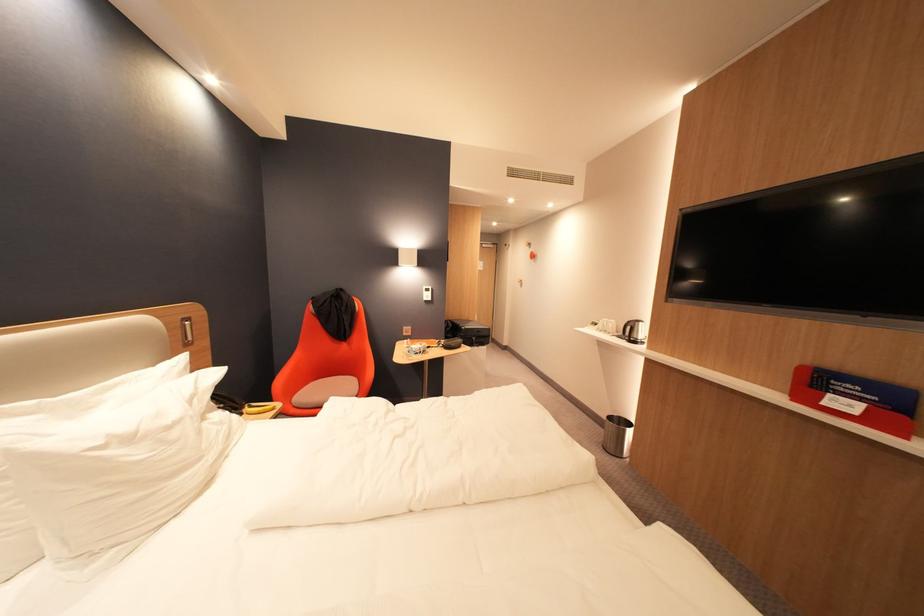
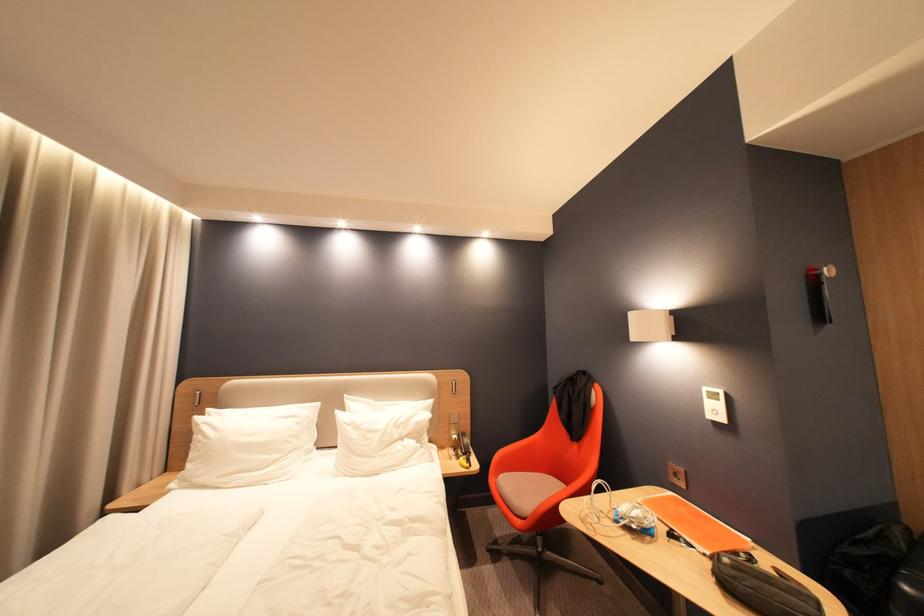
Find the pixel in the second image that matches point (198, 354) in the first image.

(443, 400)